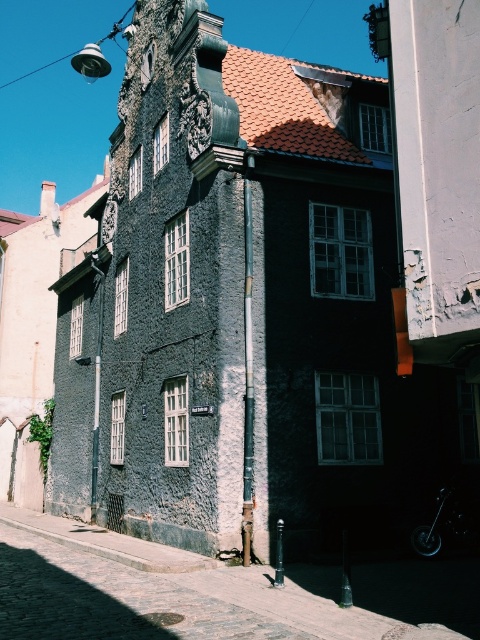
You are a delivery person standing in front of the historic building and need to park your shiny metallic motorcycle at lower right. The cobblestone pavement at lower left is where you usually park your bike. Which direction should you move your motorcycle to reach the parking spot?

The cobblestone pavement at lower left is to the left of the shiny metallic motorcycle at lower right, so you should move the motorcycle to the left to reach the parking spot.

Consider the image. You are a delivery person standing on the cobblestone pavement at lower left and need to reach the shiny metallic motorcycle at lower right. Which direction should you move to get closer to the motorcycle?

Since the cobblestone pavement at lower left is closer to the viewer than the shiny metallic motorcycle at lower right, you should move forward towards the motorcycle to get closer to it.